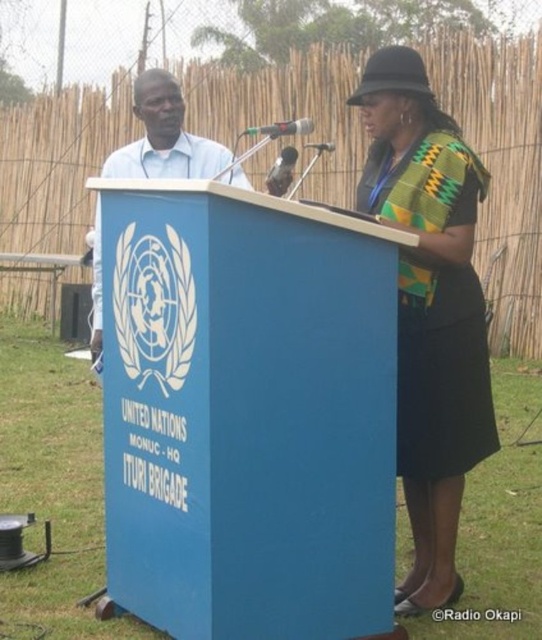
From the picture: You are a photographer trying to capture the two points in the image. Which point, point [324,268] or point [98,236], will appear larger in your photo?

Point [324,268] is closer to the camera than point [98,236], so it will appear larger in the photo.

Consider the image. You are a photographer positioned at the back of the room. You need to take a clear photo of the metallic shiny microphone at center but want to ensure the matte blue podium at left is also visible. Which object should you focus on first to ensure both are in frame?

The matte blue podium at left is closer to the viewer than the metallic shiny microphone at center. To ensure both are in frame, focus on the matte blue podium at left first, as it is closer, and adjust the camera angle to include the microphone in the background.

You are a photographer positioned behind the blue painted wood podium at center and want to capture a clear shot of the metallic shiny microphone at center. Which direction should you move to ensure the microphone is in the frame?

The blue painted wood podium at center is located below the metallic shiny microphone at center, so you should move upwards to ensure the microphone is in the frame.